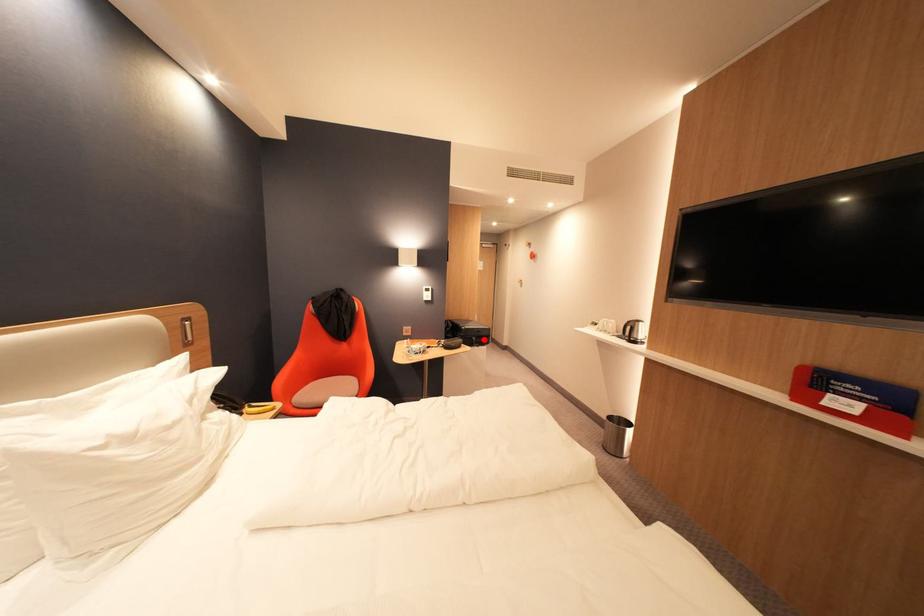
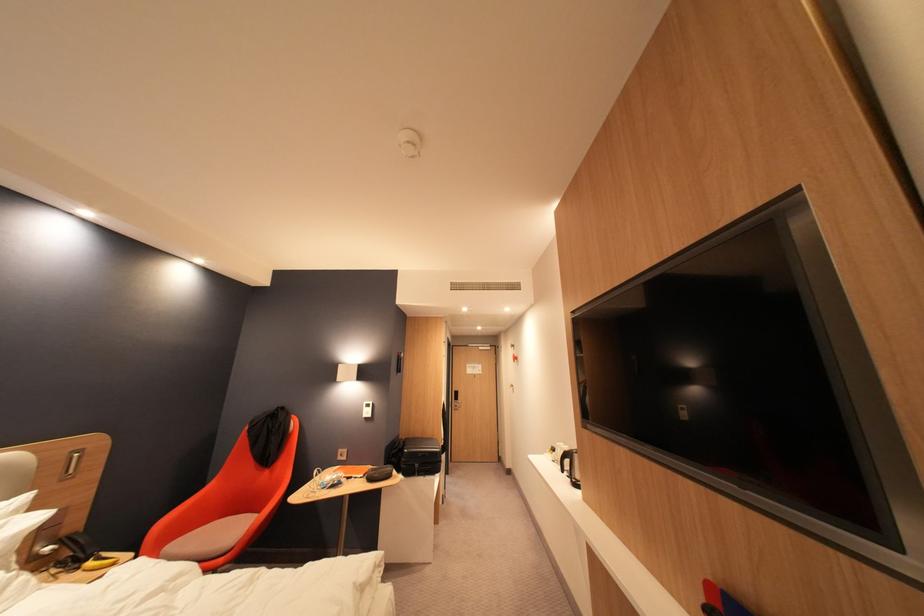
In the second image, find the point that corresponds to the highlighted location in the first image.

(427, 467)